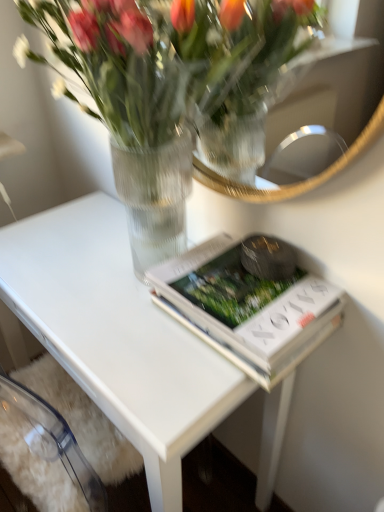
Identify the location of vacant space to the left of clear glass vase at upper center. The width and height of the screenshot is (384, 512). (44, 264).